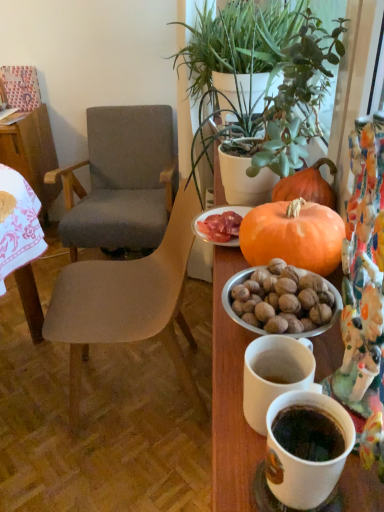
What is the approximate width of textured gray fabric chair at left, the 1th chair in the front-to-back sequence?

The width of textured gray fabric chair at left, the 1th chair in the front-to-back sequence, is 20.76 inches.

The width and height of the screenshot is (384, 512). What do you see at coordinates (306, 447) in the screenshot?
I see `white ceramic mug at lower right` at bounding box center [306, 447].

Image resolution: width=384 pixels, height=512 pixels. I want to click on wooden table at left, so click(32, 154).

How much space does green leafy plant at upper right, marked as the first houseplant in a front-to-back arrangement, occupy horizontally?

The width of green leafy plant at upper right, marked as the first houseplant in a front-to-back arrangement, is 11.92 inches.

What is the approximate width of metallic silver bowl at right?

metallic silver bowl at right is 16.67 centimeters wide.

The height and width of the screenshot is (512, 384). I want to click on textured gray fabric chair at left, the 1th chair in the front-to-back sequence, so click(x=128, y=302).

From a real-world perspective, is white ceramic mug at lower right on top of matte orange plate at center?

Indeed, from a real-world perspective, white ceramic mug at lower right stands above matte orange plate at center.

Which object is thinner, white ceramic mug at lower right or matte orange plate at center?

white ceramic mug at lower right is thinner.

In the image, is white ceramic mug at lower right on the left side or the right side of matte orange plate at center?

Based on their positions, white ceramic mug at lower right is located to the right of matte orange plate at center.

Considering the relative sizes of white ceramic mug at lower right and matte orange plate at center in the image provided, is white ceramic mug at lower right shorter than matte orange plate at center?

No.

Is white ceramic mug at lower right taller than wooden table at left?

In fact, white ceramic mug at lower right may be shorter than wooden table at left.

Considering the sizes of objects white ceramic mug at lower right and wooden table at left in the image provided, who is wider, white ceramic mug at lower right or wooden table at left?

wooden table at left is wider.

What's the angular difference between white ceramic mug at lower right and wooden table at left's facing directions?

The angular difference between white ceramic mug at lower right and wooden table at left is 90.3 degrees.

Is white ceramic mug at lower right oriented towards wooden table at left?

No.

Based on the photo, does wooden table at left lie behind white ceramic mug at lower right?

Yes, wooden table at left is behind white ceramic mug at lower right.

Is white ceramic mug at lower right a part of wooden table at left?

No, white ceramic mug at lower right is not surrounded by wooden table at left.

Who is taller, wooden table at left or white ceramic mug at lower right?

wooden table at left is taller.

Is matte orange plate at center behind white ceramic mug at lower right?

Yes, matte orange plate at center is behind white ceramic mug at lower right.

In the image, is matte orange plate at center on the left side or the right side of white ceramic mug at lower right?

In the image, matte orange plate at center appears on the left side of white ceramic mug at lower right.

You are a GUI agent. You are given a task and a screenshot of the screen. Output one action in this format:
    pyautogui.click(x=<x>, y=<y>)
    Task: Click on the coffee cup on the right of the matte orange plate at center
    This screenshot has height=512, width=384.
    Given the screenshot: What is the action you would take?
    pyautogui.click(x=306, y=447)

Considering the positions of objects textured gray fabric chair at left, which is counted as the 2th chair, starting from the back, and matte orange plate at center in the image provided, who is more to the left, textured gray fabric chair at left, which is counted as the 2th chair, starting from the back, or matte orange plate at center?

Positioned to the left is textured gray fabric chair at left, which is counted as the 2th chair, starting from the back.

Which point is more distant from viewer, (65, 322) or (199, 218)?

The point (65, 322) is more distant.

Consider the image. From the image's perspective, between textured gray fabric chair at left, the 1th chair in the front-to-back sequence, and matte orange plate at center, who is located below?

textured gray fabric chair at left, the 1th chair in the front-to-back sequence, appears lower in the image.

Which object is further away from the camera taking this photo, textured gray fabric chair at left, the 1th chair in the front-to-back sequence, or matte orange plate at center?

textured gray fabric chair at left, the 1th chair in the front-to-back sequence, is further away from the camera.

Identify the location of bowl above the textured gray fabric chair at left, the 1th chair in the front-to-back sequence (from the image's perspective). Image resolution: width=384 pixels, height=512 pixels. (230, 298).

Between metallic silver bowl at right and textured gray fabric chair at left, which is counted as the 2th chair, starting from the back, which one has larger size?

textured gray fabric chair at left, which is counted as the 2th chair, starting from the back, is bigger.

Is orange matte pumpkin at center with textured gray fabric chair at left, which is counted as the 2th chair, starting from the back?

No, orange matte pumpkin at center is not next to textured gray fabric chair at left, which is counted as the 2th chair, starting from the back.

Which is in front, point (303, 220) or point (131, 287)?

The point (303, 220) is closer.

In terms of size, does orange matte pumpkin at center appear bigger or smaller than textured gray fabric chair at left, which is counted as the 2th chair, starting from the back?

Clearly, orange matte pumpkin at center is smaller in size than textured gray fabric chair at left, which is counted as the 2th chair, starting from the back.

From the image's perspective, who appears lower, orange matte pumpkin at center or textured gray fabric chair at left, the 1th chair in the front-to-back sequence?

textured gray fabric chair at left, the 1th chair in the front-to-back sequence, appears lower in the image.

Identify the location of plate located above the white ceramic mug at lower right (from the image's perspective). This screenshot has width=384, height=512. click(x=218, y=214).

This screenshot has height=512, width=384. In order to click on coffee cup below the wooden table at left (from the image's perspective) in this screenshot , I will do `click(306, 447)`.

Considering their positions, is gray fabric chair at center, the first chair viewed from the back, positioned closer to green leafy plant at upper center, marked as the first houseplant in a back-to-front arrangement, than green leafy plant at upper right, marked as the first houseplant in a front-to-back arrangement?

The object closer to green leafy plant at upper center, marked as the first houseplant in a back-to-front arrangement, is green leafy plant at upper right, marked as the first houseplant in a front-to-back arrangement.

Estimate the real-world distances between objects in this image. Which object is closer to metallic silver bowl at right, matte orange plate at center or wooden table at left?

matte orange plate at center lies closer to metallic silver bowl at right than the other object.

From the image, which object appears to be farther from gray fabric chair at center, the first chair viewed from the back, green leafy plant at upper right, marked as the 2th houseplant in a back-to-front arrangement, or matte orange plate at center?

matte orange plate at center is positioned further to the anchor gray fabric chair at center, the first chair viewed from the back.

Considering their positions, is white ceramic mug at lower right positioned closer to green leafy plant at upper center, marked as the first houseplant in a back-to-front arrangement, than wooden table at left?

wooden table at left lies closer to green leafy plant at upper center, marked as the first houseplant in a back-to-front arrangement, than the other object.

Based on their spatial positions, is metallic silver bowl at right or white ceramic mug at lower right further from textured gray fabric chair at left, which is counted as the 2th chair, starting from the back?

Among the two, white ceramic mug at lower right is located further to textured gray fabric chair at left, which is counted as the 2th chair, starting from the back.

Considering their positions, is white ceramic mug at lower right positioned further to metallic silver bowl at right than green leafy plant at upper right, marked as the first houseplant in a front-to-back arrangement?

green leafy plant at upper right, marked as the first houseplant in a front-to-back arrangement, lies further to metallic silver bowl at right than the other object.

Estimate the real-world distances between objects in this image. Which object is closer to green leafy plant at upper right, marked as the 2th houseplant in a back-to-front arrangement, wooden table at left or green leafy plant at upper center, marked as the first houseplant in a back-to-front arrangement?

The object closer to green leafy plant at upper right, marked as the 2th houseplant in a back-to-front arrangement, is green leafy plant at upper center, marked as the first houseplant in a back-to-front arrangement.

Looking at the image, which one is located further to gray fabric chair at center, which is the second chair from front to back, orange matte pumpkin at center or metallic silver bowl at right?

metallic silver bowl at right is positioned further to the anchor gray fabric chair at center, which is the second chair from front to back.

Find the location of a particular element. The height and width of the screenshot is (512, 384). chair between textured gray fabric chair at left, the 1th chair in the front-to-back sequence, and wooden table at left in the front-back direction is located at coordinates (121, 180).

Identify the location of plate between wooden table at left and green leafy plant at upper center, marked as the first houseplant in a back-to-front arrangement, in the horizontal direction. The width and height of the screenshot is (384, 512). click(x=218, y=214).

Locate an element on the screen. The width and height of the screenshot is (384, 512). plate between green leafy plant at upper center, marked as the first houseplant in a back-to-front arrangement, and white ceramic mug at lower right in the up-down direction is located at coordinates (218, 214).

Image resolution: width=384 pixels, height=512 pixels. I want to click on bowl between white ceramic mug at lower right and matte orange plate at center along the z-axis, so click(230, 298).